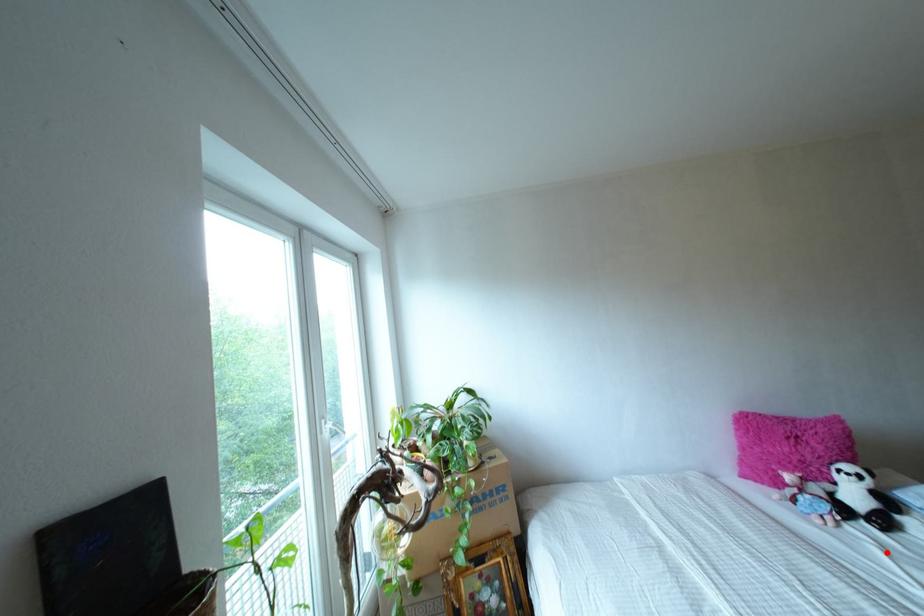
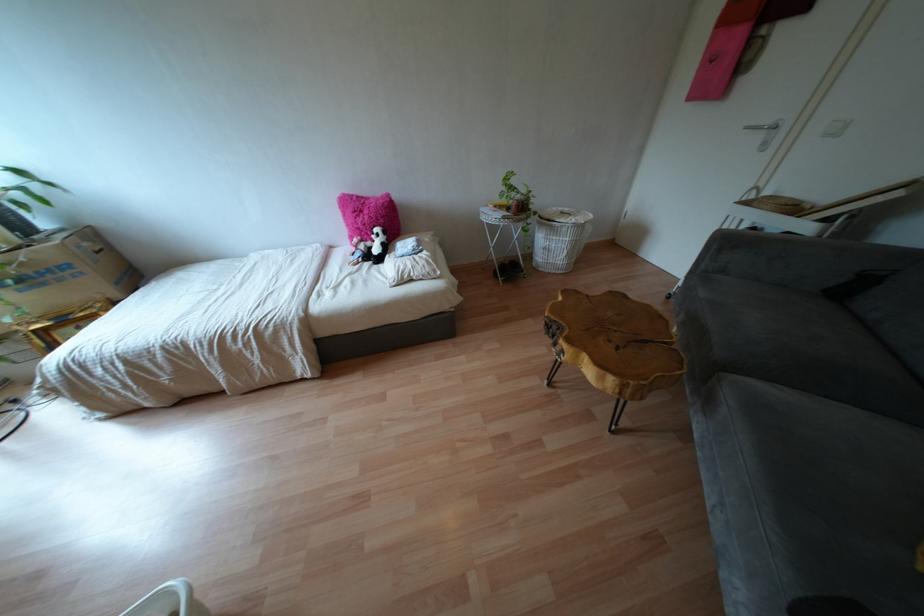
Question: I am providing you with two images of the same scene from different viewpoints. Image1 has a red point marked. In image2, the corresponding 3D location appears at what relative position? Reply with the corresponding letter.

Choices:
 (A) Closer
 (B) Farther

Answer: (B)